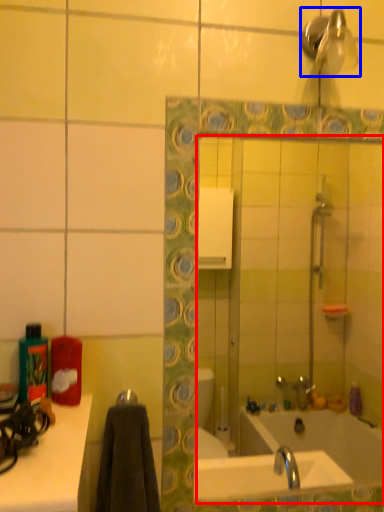
Question: Among these objects, which one is farthest to the camera, mirror (highlighted by a red box) or shower (highlighted by a blue box)?

Choices:
 (A) mirror
 (B) shower

Answer: (A)